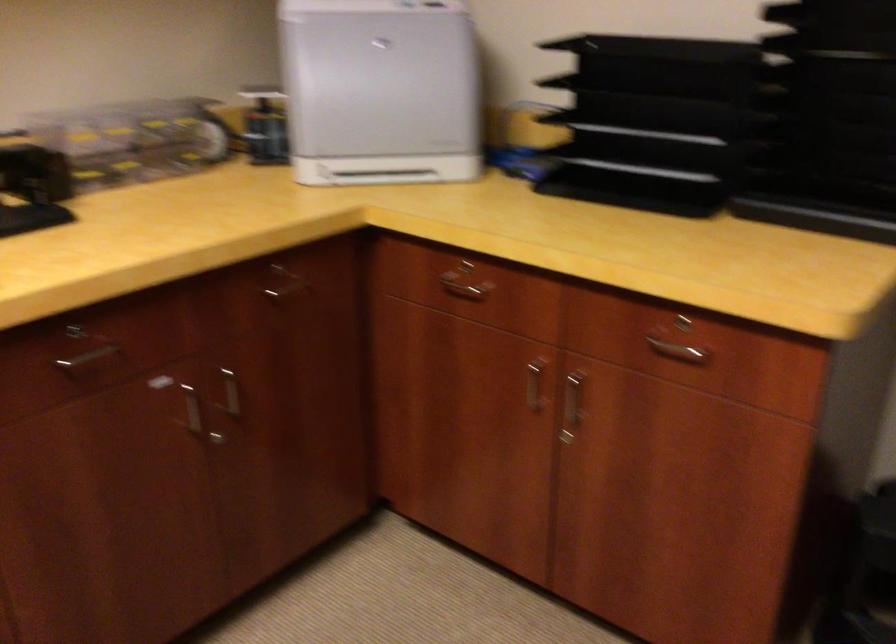
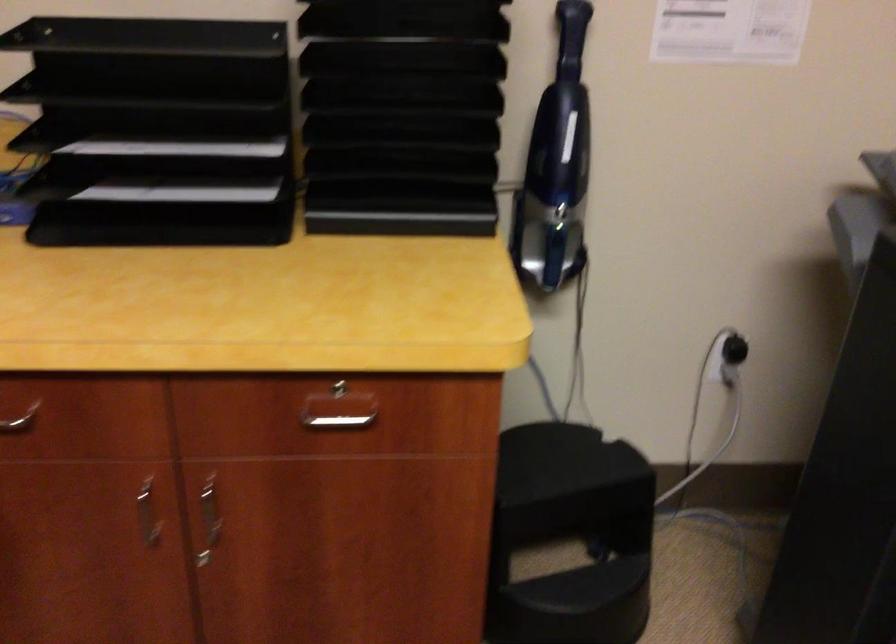
Where in the second image is the point corresponding to pixel 659 91 from the first image?

(156, 89)